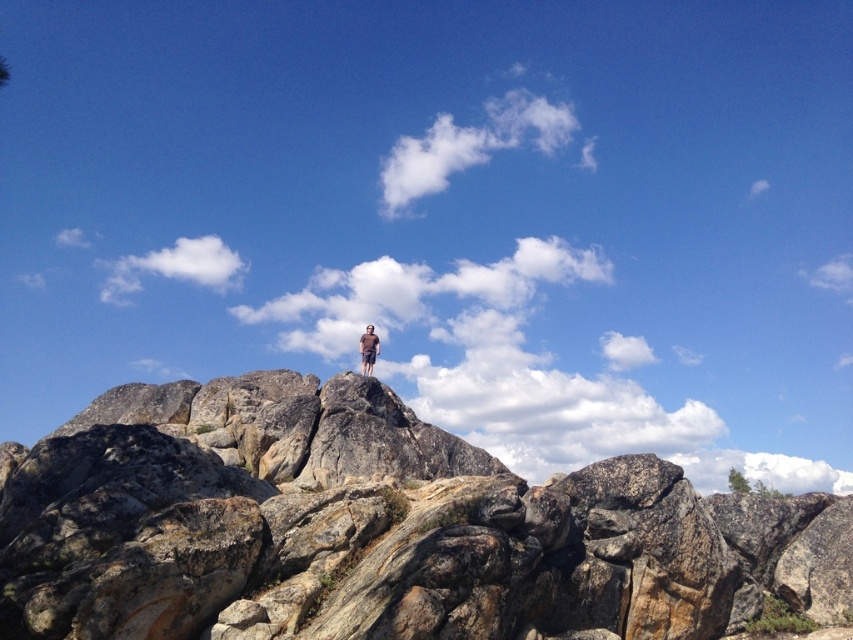
Does rough granite boulder at center have a lesser height compared to brown cotton shirt at center?

In fact, rough granite boulder at center may be taller than brown cotton shirt at center.

Between rough granite boulder at center and brown cotton shirt at center, which one appears on the right side from the viewer's perspective?

From the viewer's perspective, rough granite boulder at center appears more on the right side.

What do you see at coordinates (375, 529) in the screenshot?
I see `rough granite boulder at center` at bounding box center [375, 529].

You are a GUI agent. You are given a task and a screenshot of the screen. Output one action in this format:
    pyautogui.click(x=<x>, y=<y>)
    Task: Click on the rough granite boulder at center
    The width and height of the screenshot is (853, 640).
    Given the screenshot: What is the action you would take?
    pyautogui.click(x=375, y=529)